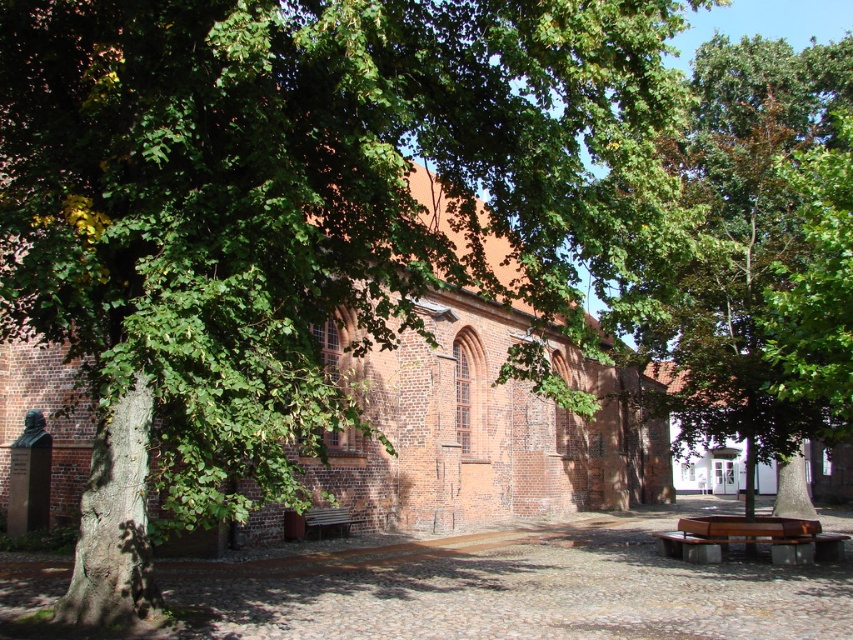
Who is positioned more to the right, green leafy tree at center or brown wooden bench at lower right?

green leafy tree at center

Who is higher up, green leafy tree at center or brown wooden bench at lower right?

green leafy tree at center is above.

Is point (816, 138) farther from camera compared to point (793, 545)?

Yes, point (816, 138) is behind point (793, 545).

The width and height of the screenshot is (853, 640). In order to click on green leafy tree at center in this screenshot , I will do `click(767, 252)`.

What do you see at coordinates (767, 252) in the screenshot?
I see `green leafy tree at center` at bounding box center [767, 252].

Is green leafy tree at center taller than brown wooden bench at center?

Indeed, green leafy tree at center has a greater height compared to brown wooden bench at center.

Is point (747, 435) closer to camera compared to point (335, 525)?

Yes, it is in front of point (335, 525).

I want to click on green leafy tree at center, so click(x=767, y=252).

Can you confirm if brown wooden bench at lower right is positioned above brown wooden bench at center?

Indeed, brown wooden bench at lower right is positioned over brown wooden bench at center.

Does brown wooden bench at lower right have a lesser height compared to brown wooden bench at center?

No, brown wooden bench at lower right is not shorter than brown wooden bench at center.

This screenshot has width=853, height=640. What do you see at coordinates (750, 538) in the screenshot? I see `brown wooden bench at lower right` at bounding box center [750, 538].

At what (x,y) coordinates should I click in order to perform the action: click on brown wooden bench at lower right. Please return your answer as a coordinate pair (x, y). Looking at the image, I should click on (750, 538).